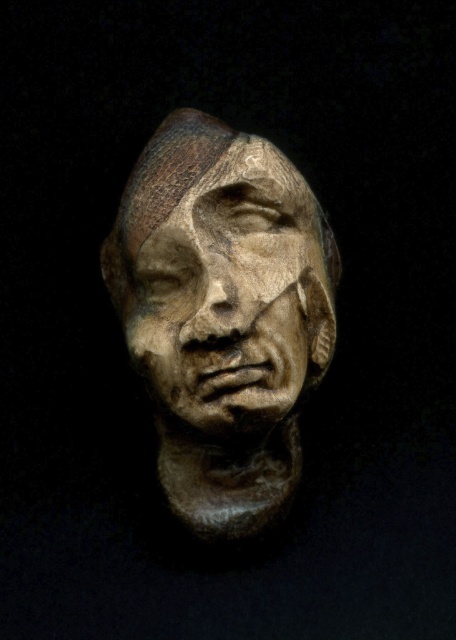
You are an art curator examining two sculptures displayed in a gallery. You notice the wooden sculpture at center and the matte bronze sculpture at center. Which sculpture would appear larger to a visitor standing directly in front of them?

The wooden sculpture at center appears larger because it is closer to the viewer than the matte bronze sculpture at center.

You are an art conservator working on a display case that requires two sculptures to be placed exactly 1 inch apart. You have the wooden sculpture at center and the matte bronze sculpture at center. Based on their current positions, will they fit the display case requirement?

The wooden sculpture at center is 0.62 inches from matte bronze sculpture at center, which is less than the required 1 inch. Therefore, they are too close and won